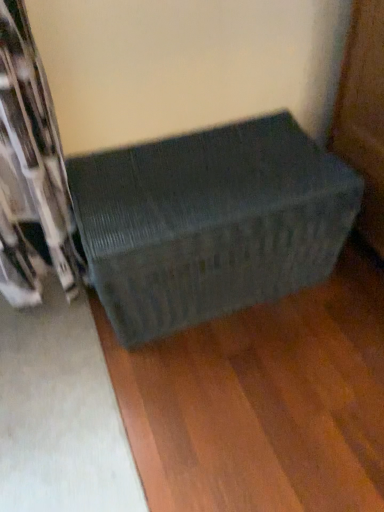
Identify the location of free spot above textured gray chest at center (from a real-world perspective). This screenshot has height=512, width=384. (190, 195).